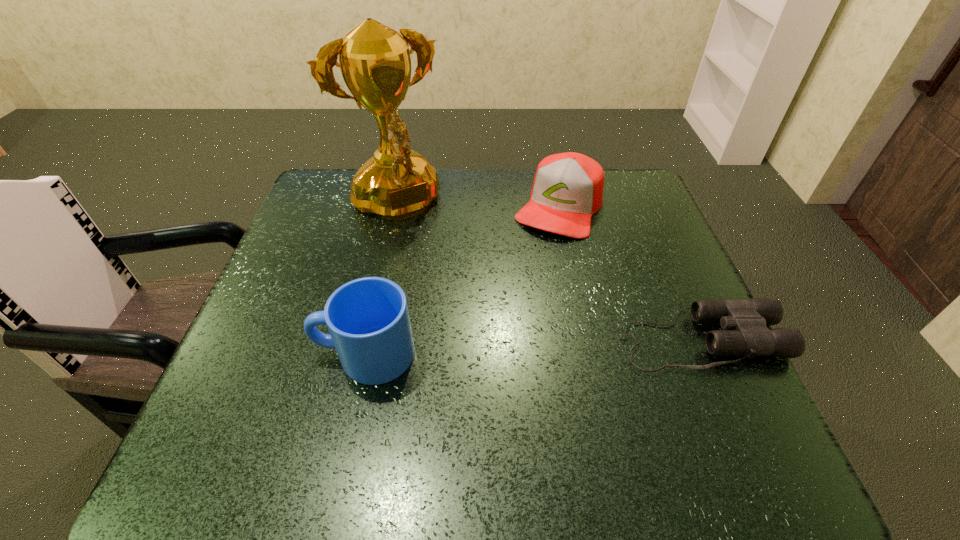
The height and width of the screenshot is (540, 960). Find the location of `vacant space on the desktop that is between the mug and the binoculars and is positioned on the front-facing side of the baseball cap`. vacant space on the desktop that is between the mug and the binoculars and is positioned on the front-facing side of the baseball cap is located at coordinates (485, 349).

You are a GUI agent. You are given a task and a screenshot of the screen. Output one action in this format:
    pyautogui.click(x=<x>, y=<y>)
    Task: Click on the free space on the desktop that is between the mug and the shortest object and is positioned on the front side of the tallest object
    This screenshot has height=540, width=960.
    Given the screenshot: What is the action you would take?
    pyautogui.click(x=492, y=349)